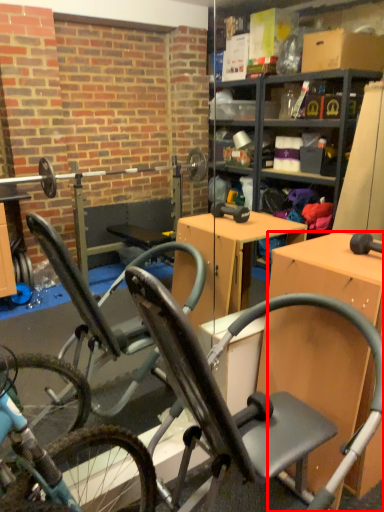
Question: From the image's perspective, where is desk (annotated by the red box) located relative to chair?

Choices:
 (A) above
 (B) below

Answer: (A)